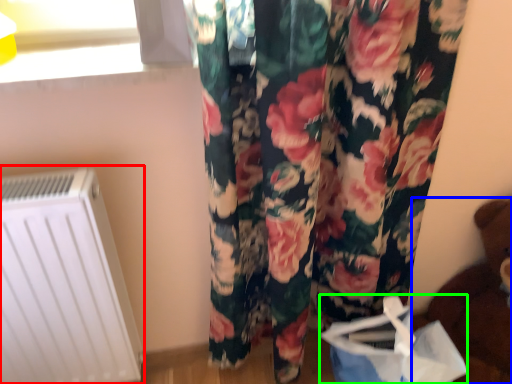
Question: Which object is the farthest from radiator (highlighted by a red box)? Choose among these: toy (highlighted by a blue box) or shopping bag (highlighted by a green box).

Choices:
 (A) toy
 (B) shopping bag

Answer: (A)